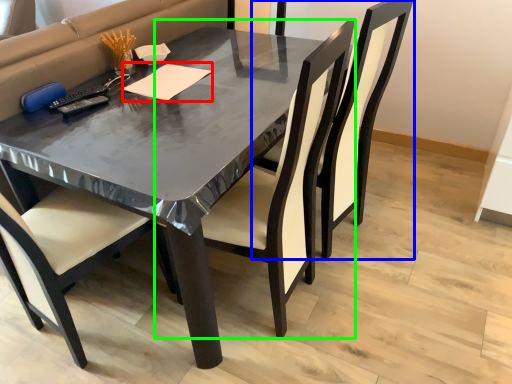
Question: Considering the real-world distances, which object is closest to notepad (highlighted by a red box)? chair (highlighted by a blue box) or chair (highlighted by a green box).

Choices:
 (A) chair
 (B) chair

Answer: (B)